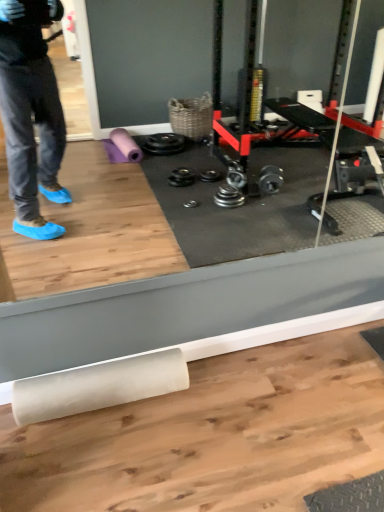
Locate an element on the screen. Image resolution: width=384 pixels, height=512 pixels. vacant area that is situated to the right of white matte paper towel at lower center is located at coordinates (206, 420).